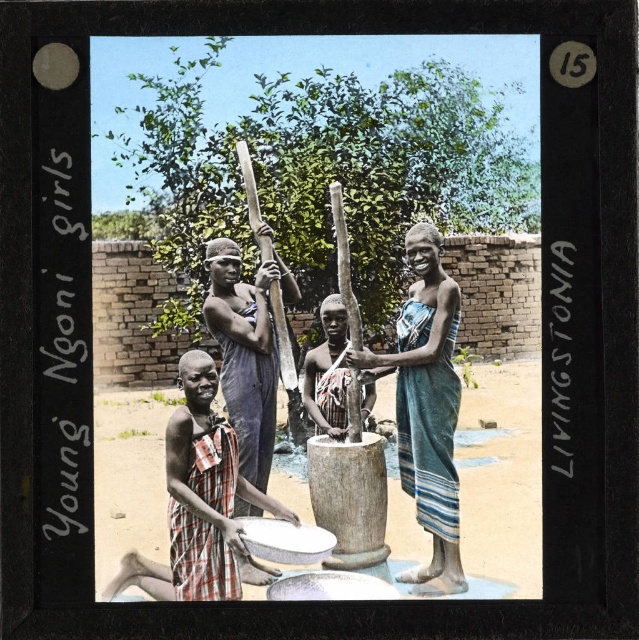
Question: Which point is farther to the camera?

Choices:
 (A) (259, 316)
 (B) (389, 372)

Answer: (A)

Question: Which point appears closest to the camera in this image?

Choices:
 (A) (459, 420)
 (B) (212, 275)
 (C) (433, 419)

Answer: (B)

Question: Which point is farther from the camera taking this photo?

Choices:
 (A) (468, 388)
 (B) (238, 424)

Answer: (A)

Question: Can you confirm if brown dirt field at lower center is positioned above blue striped cloth at center?

Choices:
 (A) no
 (B) yes

Answer: (A)

Question: Can you confirm if brown dirt field at lower center is wider than blue striped cloth at center?

Choices:
 (A) no
 (B) yes

Answer: (A)

Question: Where is brown dirt field at lower center located in relation to dark brown wood staff at center in the image?

Choices:
 (A) right
 (B) left

Answer: (A)